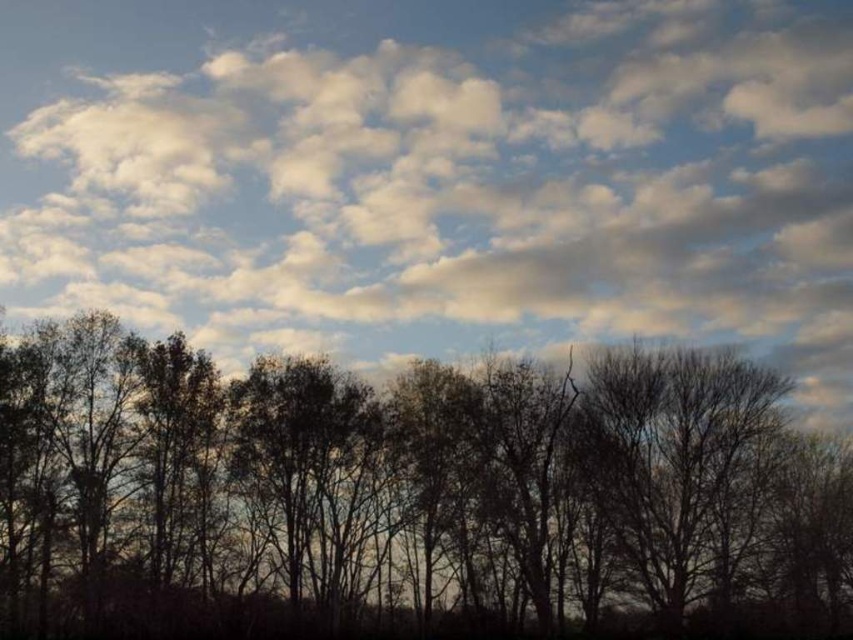
Between white fluffy cloud at upper center and silhouette tree at lower center, which one appears on the right side from the viewer's perspective?

From the viewer's perspective, silhouette tree at lower center appears more on the right side.

Who is more distant from viewer, (x=485, y=129) or (x=286, y=563)?

Positioned behind is point (x=485, y=129).

Is point (354, 346) farther from camera compared to point (521, 385)?

Yes.

What are the coordinates of `white fluffy cloud at upper center` in the screenshot? It's located at (437, 173).